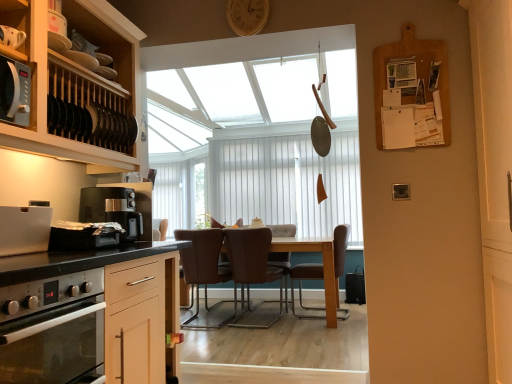
Question: Considering the relative positions of brown leather chair at center, placed as the third chair when sorted from left to right, and brown leather chair at center, placed as the second chair when sorted from left to right, in the image provided, is brown leather chair at center, placed as the third chair when sorted from left to right, in front of brown leather chair at center, placed as the second chair when sorted from left to right,?

Choices:
 (A) yes
 (B) no

Answer: (B)

Question: Is brown leather chair at center, placed as the second chair when sorted from left to right, a part of brown leather chair at center, placed as the third chair when sorted from left to right?

Choices:
 (A) no
 (B) yes

Answer: (A)

Question: Does brown leather chair at center, which ranks as the 1th chair in right-to-left order, have a larger size compared to brown leather chair at center, the second chair in the right-to-left sequence?

Choices:
 (A) no
 (B) yes

Answer: (B)

Question: Does brown leather chair at center, placed as the third chair when sorted from left to right, have a smaller size compared to brown leather chair at center, the second chair in the right-to-left sequence?

Choices:
 (A) yes
 (B) no

Answer: (B)

Question: Can you confirm if brown leather chair at center, which ranks as the 1th chair in right-to-left order, is wider than brown leather chair at center, placed as the second chair when sorted from left to right?

Choices:
 (A) no
 (B) yes

Answer: (B)

Question: Is brown leather chair at center, placed as the third chair when sorted from left to right, at the right side of brown leather chair at center, placed as the second chair when sorted from left to right?

Choices:
 (A) yes
 (B) no

Answer: (A)

Question: Does black glass oven at lower left have a greater width compared to brown leather chair at center, acting as the first chair starting from the left?

Choices:
 (A) no
 (B) yes

Answer: (A)

Question: Does black glass oven at lower left turn towards brown leather chair at center, the third chair when ordered from right to left?

Choices:
 (A) no
 (B) yes

Answer: (A)

Question: From the image's perspective, is black glass oven at lower left on brown leather chair at center, acting as the first chair starting from the left?

Choices:
 (A) no
 (B) yes

Answer: (B)

Question: Does black glass oven at lower left have a greater height compared to brown leather chair at center, acting as the first chair starting from the left?

Choices:
 (A) yes
 (B) no

Answer: (B)

Question: Are black glass oven at lower left and brown leather chair at center, the third chair when ordered from right to left, beside each other?

Choices:
 (A) yes
 (B) no

Answer: (B)

Question: Does black glass oven at lower left have a smaller size compared to brown leather chair at center, acting as the first chair starting from the left?

Choices:
 (A) yes
 (B) no

Answer: (A)

Question: From the image's perspective, is brown leather chair at center, the second chair in the right-to-left sequence, located above brown leather swivel chair at center?

Choices:
 (A) yes
 (B) no

Answer: (A)